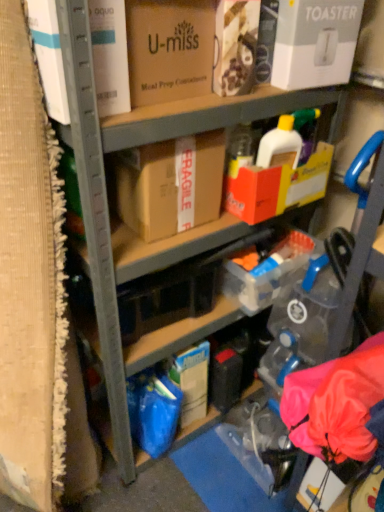
Question: Is brown cardboard box at center, the fourth box when ordered from right to left, wider or thinner than matte cardboard box at upper center, acting as the 1th box starting from the left?

Choices:
 (A) wide
 (B) thin

Answer: (B)

Question: From a real-world perspective, is brown cardboard box at center, the fourth box when ordered from right to left, positioned above or below matte cardboard box at upper center, marked as the fifth box in a right-to-left arrangement?

Choices:
 (A) below
 (B) above

Answer: (A)

Question: Which is farther from the white cardboard toaster at upper right, positioned as the first box in right-to-left order?

Choices:
 (A) matte cardboard box at upper center, positioned as the 3th box in left-to-right order
 (B) matte cardboard box at upper center, acting as the 1th box starting from the left
 (C) yellow cardboard box at center, the 2th box when ordered from right to left
 (D) brown cardboard box at center, which is counted as the 2th box, starting from the left

Answer: (D)

Question: Which of these objects is positioned farthest from the matte cardboard box at upper center, positioned as the 3th box in left-to-right order?

Choices:
 (A) matte cardboard box at upper center, acting as the 1th box starting from the left
 (B) white cardboard toaster at upper right, positioned as the first box in right-to-left order
 (C) brown cardboard box at center, which is counted as the 2th box, starting from the left
 (D) yellow cardboard box at center, positioned as the fourth box in left-to-right order

Answer: (D)